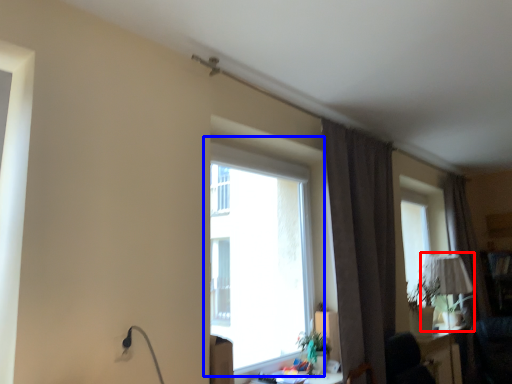
Question: Which point is closer to the camera, table lamp (highlighted by a red box) or window (highlighted by a blue box)?

Choices:
 (A) table lamp
 (B) window

Answer: (B)